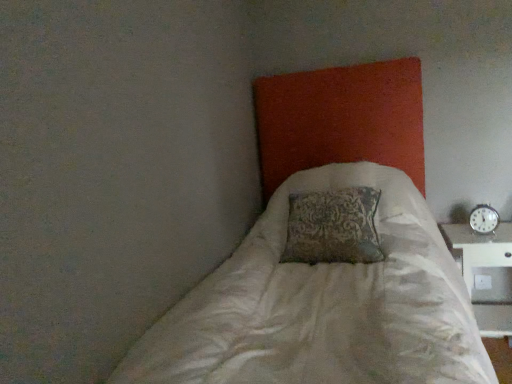
Question: Could metallic silver clock at right be considered to be inside white textured bed at center?

Choices:
 (A) yes
 (B) no

Answer: (B)

Question: Considering the relative sizes of white textured bed at center and metallic silver clock at right in the image provided, is white textured bed at center smaller than metallic silver clock at right?

Choices:
 (A) no
 (B) yes

Answer: (A)

Question: From a real-world perspective, is white textured bed at center below metallic silver clock at right?

Choices:
 (A) no
 (B) yes

Answer: (A)

Question: Considering the relative sizes of white textured bed at center and metallic silver clock at right in the image provided, is white textured bed at center taller than metallic silver clock at right?

Choices:
 (A) no
 (B) yes

Answer: (B)

Question: Is white textured bed at center in front of metallic silver clock at right?

Choices:
 (A) no
 (B) yes

Answer: (B)

Question: From the image's perspective, is white textured bed at center positioned above or below metallic silver clock at right?

Choices:
 (A) above
 (B) below

Answer: (B)

Question: Is point (283, 100) closer or farther from the camera than point (488, 228)?

Choices:
 (A) closer
 (B) farther

Answer: (B)

Question: From a real-world perspective, relative to metallic silver clock at right, is white textured bed at center vertically above or below?

Choices:
 (A) below
 (B) above

Answer: (B)

Question: Is white textured bed at center to the left or to the right of metallic silver clock at right in the image?

Choices:
 (A) right
 (B) left

Answer: (B)

Question: In terms of height, does metallic silver clock at right look taller or shorter compared to white textured bed at center?

Choices:
 (A) short
 (B) tall

Answer: (A)

Question: From a real-world perspective, relative to white textured bed at center, is metallic silver clock at right vertically above or below?

Choices:
 (A) below
 (B) above

Answer: (A)

Question: Visually, is metallic silver clock at right positioned to the left or to the right of white textured bed at center?

Choices:
 (A) left
 (B) right

Answer: (B)

Question: Is point (489, 221) positioned closer to the camera than point (268, 170)?

Choices:
 (A) closer
 (B) farther

Answer: (A)

Question: Looking at their shapes, would you say metallic silver clock at right is wider or thinner than white plastic table at right?

Choices:
 (A) thin
 (B) wide

Answer: (A)

Question: Based on their positions, is metallic silver clock at right located to the left or right of white plastic table at right?

Choices:
 (A) left
 (B) right

Answer: (A)